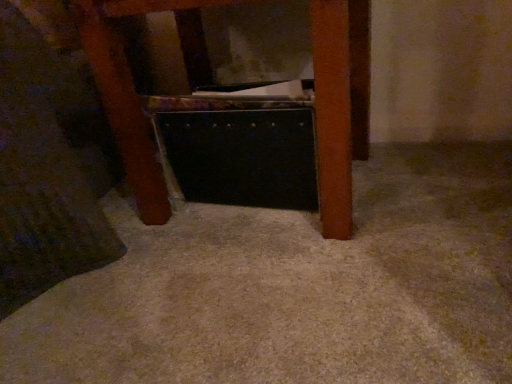
Question: From the image's perspective, is metallic black briefcase at center above or below black plastic drawer at center?

Choices:
 (A) below
 (B) above

Answer: (B)

Question: In terms of height, does metallic black briefcase at center look taller or shorter compared to black plastic drawer at center?

Choices:
 (A) short
 (B) tall

Answer: (B)

Question: Is metallic black briefcase at center spatially inside black plastic drawer at center, or outside of it?

Choices:
 (A) inside
 (B) outside

Answer: (B)

Question: Based on their positions, is black plastic drawer at center located to the left or right of metallic black briefcase at center?

Choices:
 (A) left
 (B) right

Answer: (B)

Question: Is black plastic drawer at center wider or thinner than metallic black briefcase at center?

Choices:
 (A) wide
 (B) thin

Answer: (B)

Question: Considering the positions of black plastic drawer at center and metallic black briefcase at center in the image, is black plastic drawer at center taller or shorter than metallic black briefcase at center?

Choices:
 (A) tall
 (B) short

Answer: (B)

Question: Considering their positions, is black plastic drawer at center located in front of or behind metallic black briefcase at center?

Choices:
 (A) behind
 (B) front

Answer: (A)